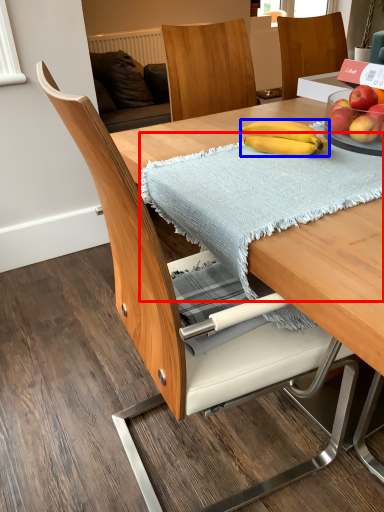
Question: Which object appears closest to the camera in this image, blanket (highlighted by a red box) or banana (highlighted by a blue box)?

Choices:
 (A) blanket
 (B) banana

Answer: (A)